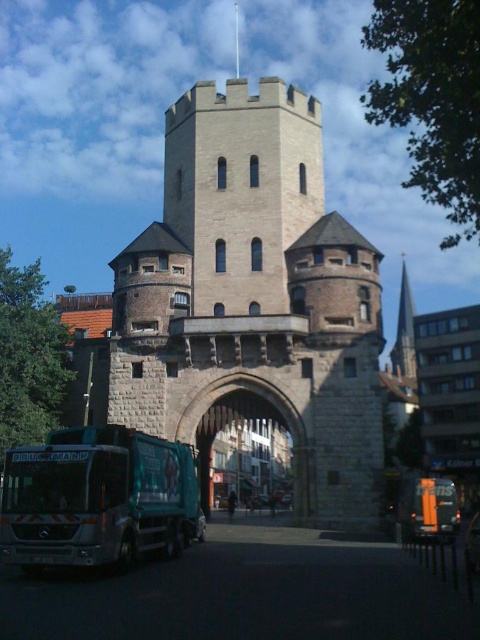
Which is in front, point (142, 488) or point (456, 504)?

Positioned in front is point (142, 488).

At what (x,y) coordinates should I click in order to perform the action: click on green metallic bus at lower left. Please return your answer as a coordinate pair (x, y). The height and width of the screenshot is (640, 480). Looking at the image, I should click on (97, 499).

Which is above, beige stone tower at center or stone archway at center?

beige stone tower at center is higher up.

Is point (201, 410) positioned before point (195, 422)?

Yes, it is.

Image resolution: width=480 pixels, height=640 pixels. Describe the element at coordinates (253, 300) in the screenshot. I see `beige stone tower at center` at that location.

Locate an element on the screen. This screenshot has width=480, height=640. beige stone tower at center is located at coordinates (253, 300).

What are the coordinates of `stone archway at center` in the screenshot? It's located at (273, 404).

The image size is (480, 640). What do you see at coordinates (273, 404) in the screenshot?
I see `stone archway at center` at bounding box center [273, 404].

Identify the location of stone archway at center. (273, 404).

Locate an element on the screen. stone archway at center is located at coordinates (273, 404).